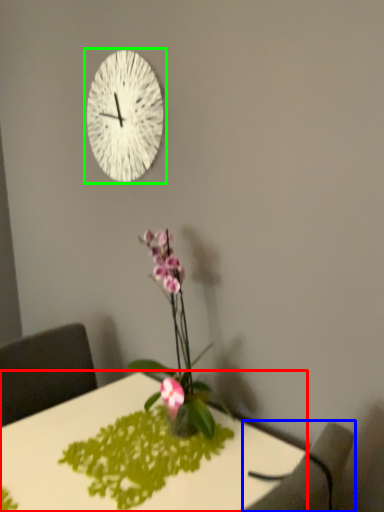
Question: Based on their relative distances, which object is farther from desk (highlighted by a red box)? Choose from armchair (highlighted by a blue box) and wall clock (highlighted by a green box).

Choices:
 (A) armchair
 (B) wall clock

Answer: (B)